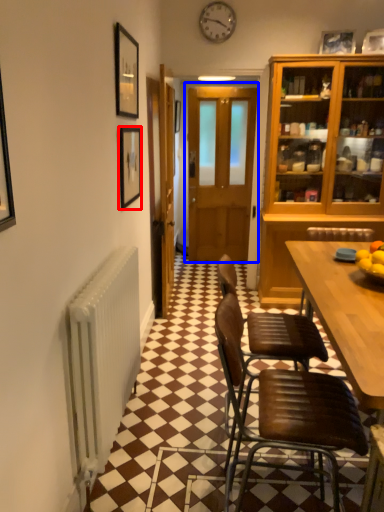
Question: Which object appears farthest to the camera in this image, picture frame (highlighted by a red box) or door (highlighted by a blue box)?

Choices:
 (A) picture frame
 (B) door

Answer: (B)